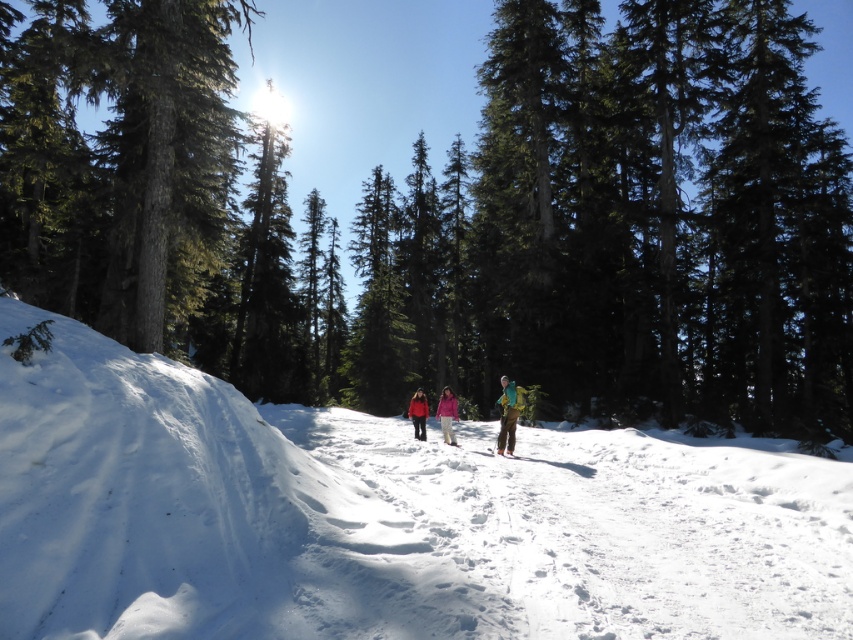
You are standing in a snowy forest and want to reach a cabin that is exactly 50 feet away from your current position. There is a green textured tree at center in front of you. Can you walk straight ahead towards the cabin without encountering the tree?

The green textured tree at center is 49.11 feet from viewer, which is less than 50 feet. Therefore, the tree is between you and the cabin, so you cannot walk straight ahead without encountering the tree.

You are planning to take a photo of the pink fabric jacket at center and the matte yellow ski at center in the winter forest scene. Which object should you focus on first if you want to capture both in a single frame without moving the camera?

The pink fabric jacket at center is bigger than the matte yellow ski at center, so you should focus on the pink fabric jacket at center first to ensure it is in clear view before adjusting the composition to include the smaller matte yellow ski at center.

In the scene shown: You are standing at the starting point of a winter hike and see two points marked in the snow ahead of you. The first point is at coordinates point (343, 577), and the second is at point (424, 422). Which point is closer to your current position?

Point (343, 577) is closer to the viewer than point (424, 422), so the first point is closer to your current position.